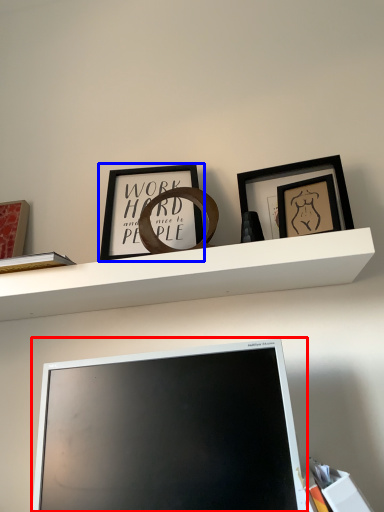
Question: Which object is further to the camera taking this photo, computer monitor (highlighted by a red box) or picture frame (highlighted by a blue box)?

Choices:
 (A) computer monitor
 (B) picture frame

Answer: (B)